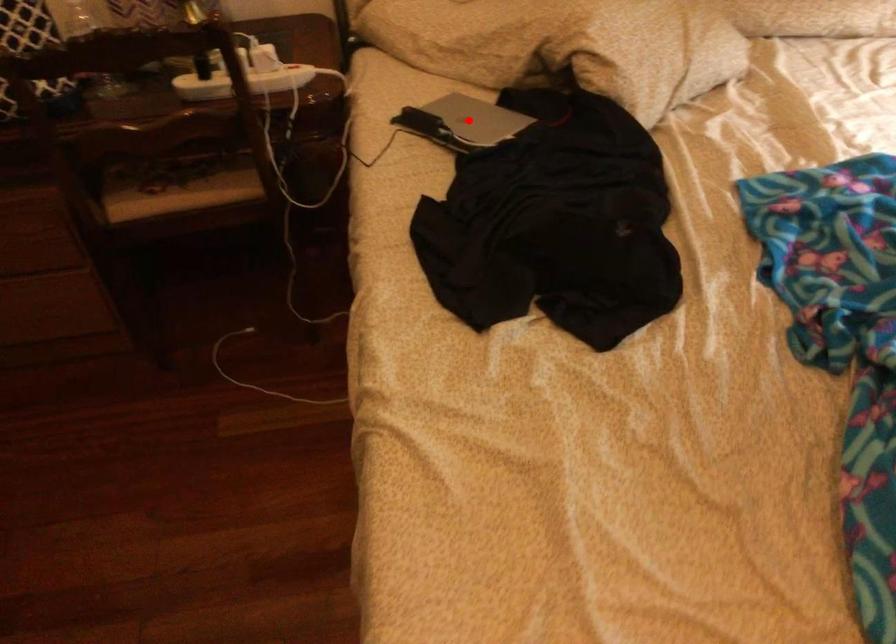
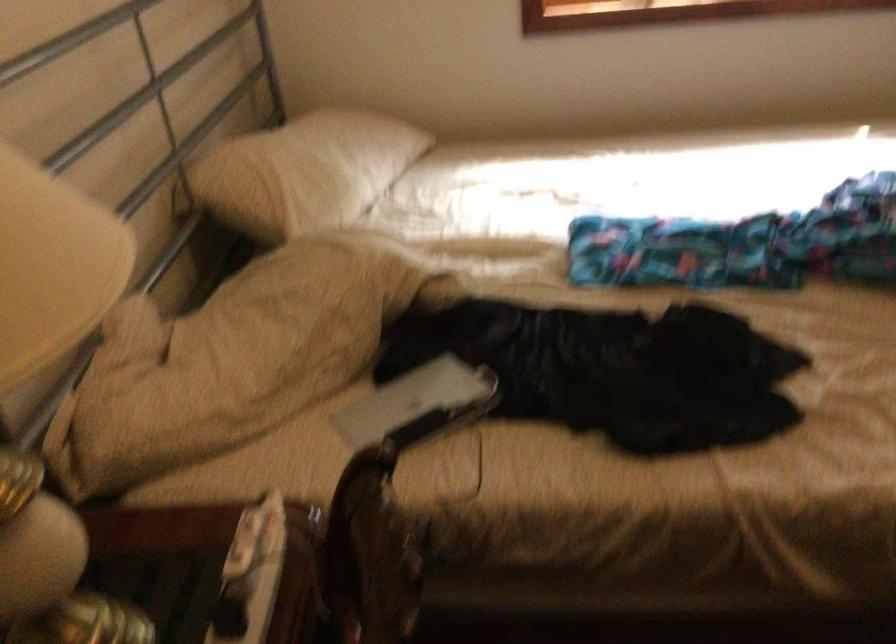
Question: I am providing you with two images of the same scene from different viewpoints. In image1, a red point is highlighted. Considering the same 3D point in image2, which of the following is correct?

Choices:
 (A) It is closer
 (B) It is farther

Answer: (A)